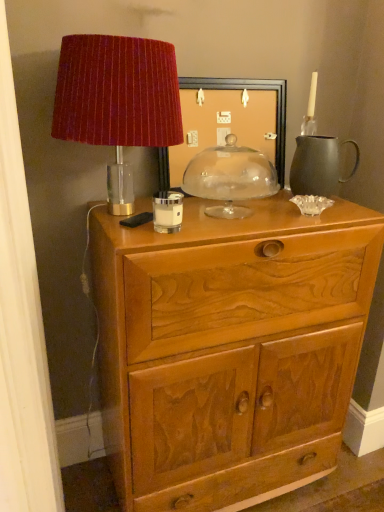
At what (x,y) coordinates should I click in order to perform the action: click on free space in front of white glass candle holder at center, marked as the first candle holder in a left-to-right arrangement. Please return your answer as a coordinate pair (x, y). This screenshot has height=512, width=384. Looking at the image, I should click on (166, 234).